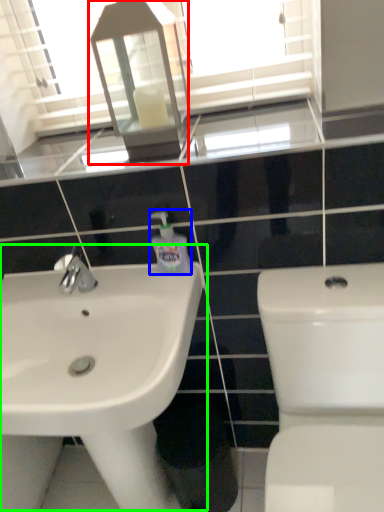
Question: Which object is positioned closest to medicine cabinet (highlighted by a red box)? Select from cleaning product (highlighted by a blue box) and sink (highlighted by a green box).

Choices:
 (A) cleaning product
 (B) sink

Answer: (A)